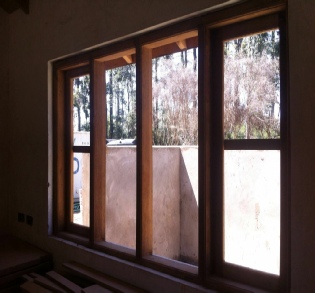
This screenshot has height=293, width=315. I want to click on floor, so click(x=71, y=241), click(x=119, y=260), click(x=196, y=286), click(x=56, y=267).